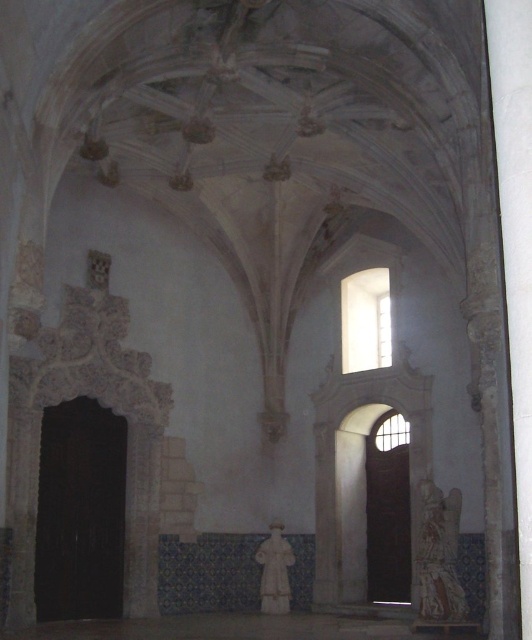
You are standing in the historical building and want to take a closer look at both the carved stone statue at right and the white marble statue at center. Which statue should you approach first to reach the one farther away without backtracking?

You should first approach the white marble statue at center because the carved stone statue at right is closer to the viewer, so the white marble statue at center is farther away. By going to the farther one first, you can then move closer to the carved stone statue at right without needing to backtrack.

You are an art historian examining the statues in the historical building. You notice the carved stone statue at right and the white marble statue at center. Which statue is positioned to the right of the other?

The carved stone statue at right is positioned to the right of the white marble statue at center.